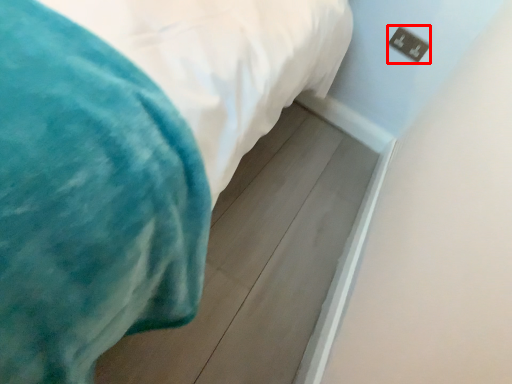
Question: From the image's perspective, considering the relative positions of electric outlet (annotated by the red box) and bed in the image provided, where is electric outlet (annotated by the red box) located with respect to the staircase?

Choices:
 (A) above
 (B) below

Answer: (A)